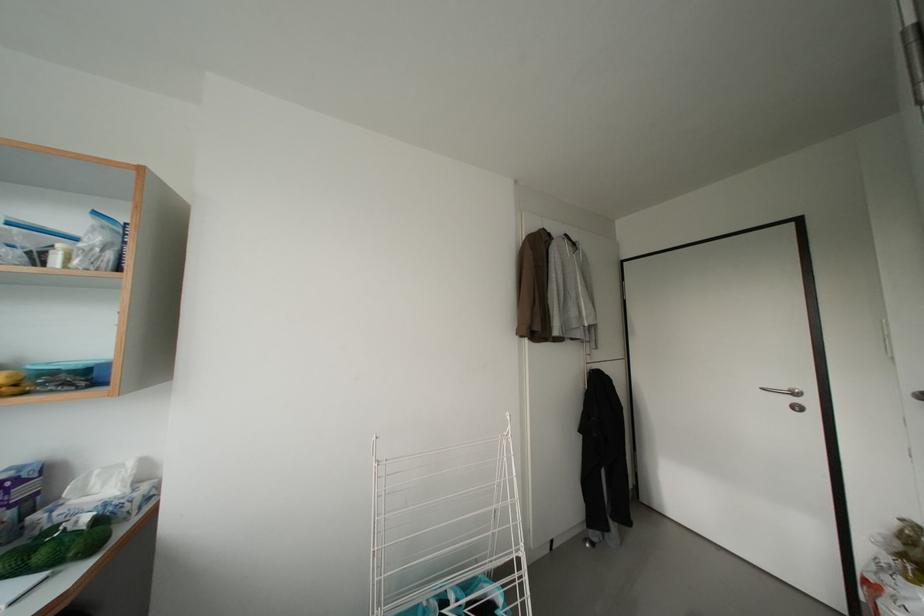
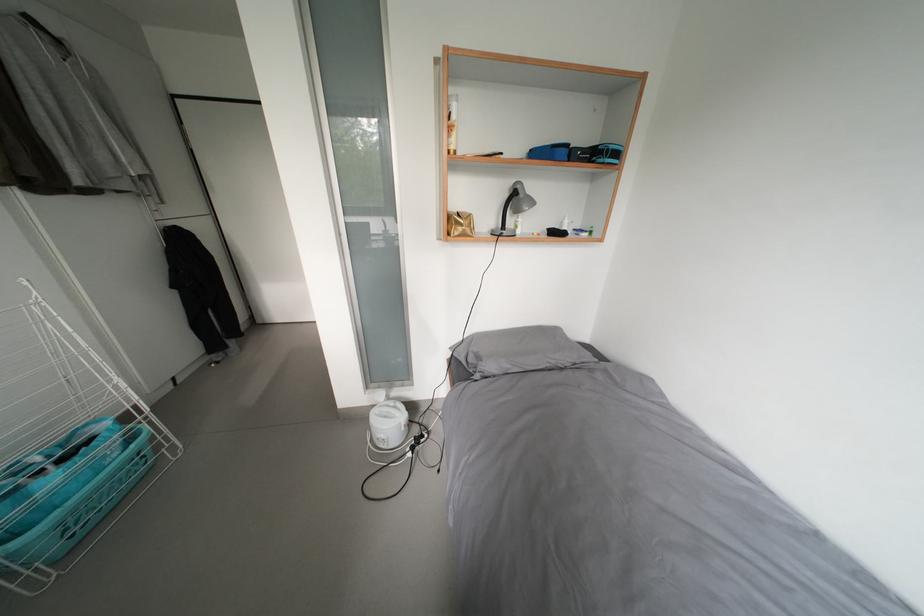
First-person continuous shooting, in which direction is the camera rotating?

The rotation direction of the camera is right-down.